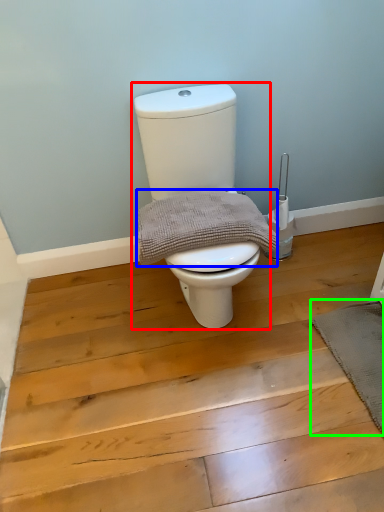
Question: Estimate the real-world distances between objects in this image. Which object is farther from toilet (highlighted by a red box), material (highlighted by a blue box) or bath mat (highlighted by a green box)?

Choices:
 (A) material
 (B) bath mat

Answer: (B)